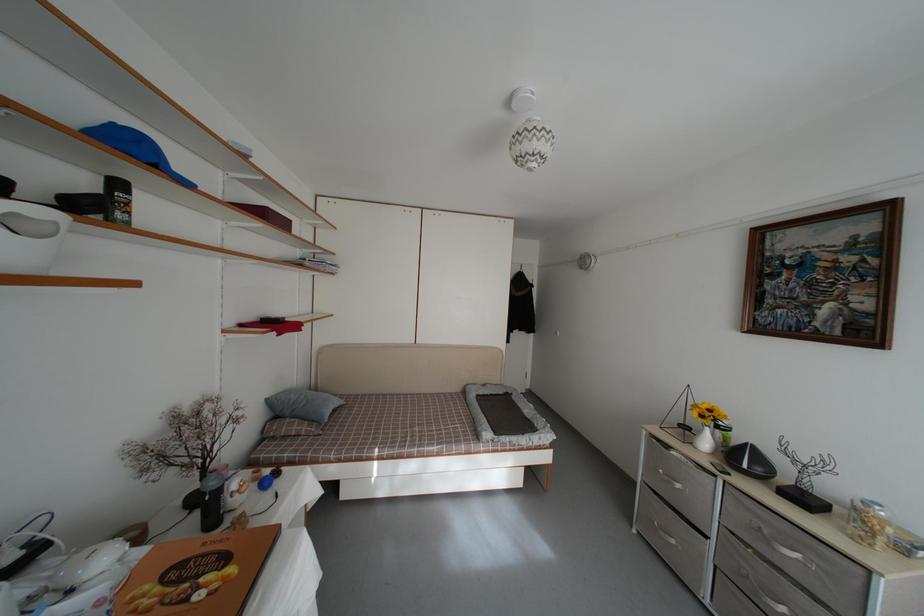
Find the location of a particular element. This screenshot has height=616, width=924. black flower vase is located at coordinates (x=187, y=445).